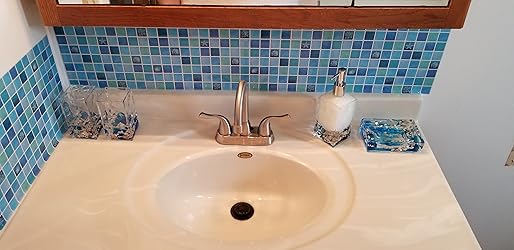
Find any where you'd turn on the water in the picture. Your answer should be formatted as a list of tuples, i.e. [(x1, y1), (x2, y2), ...], where each tuple contains the x and y coordinates of a point satisfying the conditions above.

[(222, 124), (264, 122)]